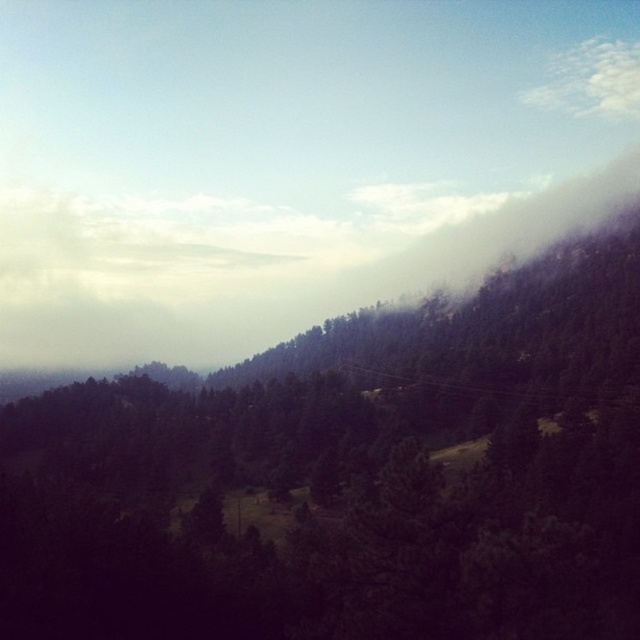
Which of these two, green matte tree at center or white fluffy cloud at upper right, stands taller?

white fluffy cloud at upper right is taller.

Who is lower down, green matte tree at center or white fluffy cloud at upper right?

green matte tree at center

Is point (163, 570) behind point (596, 38)?

No, (163, 570) is in front of (596, 38).

Find the location of `green matte tree at center`. green matte tree at center is located at coordinates pos(349,476).